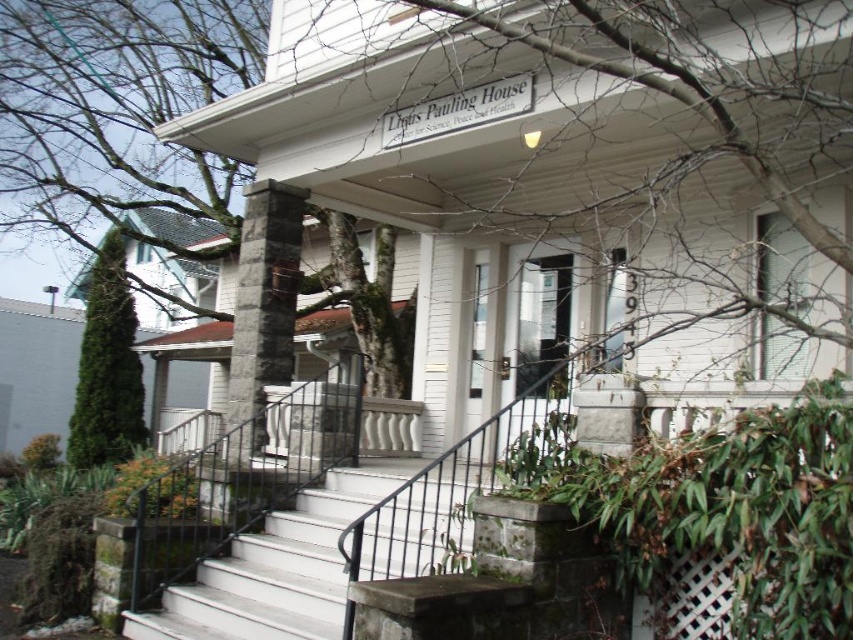
You are a delivery person trying to reach the front door of the Linus Pauling House. You see the white painted concrete stairs at center and the green coniferous tree at left. Which object is shorter in height?

The white painted concrete stairs at center has a lesser height compared to the green coniferous tree at left, so the white painted concrete stairs at center is shorter.

You are standing on the front lawn of the Linus Pauling House and want to enter the house. Which object do you need to walk past first, the white painted concrete stairs at center or the green coniferous tree at left?

You need to walk past the white painted concrete stairs at center first because it is located below the green coniferous tree at left, meaning the stairs are closer to you on the lawn.